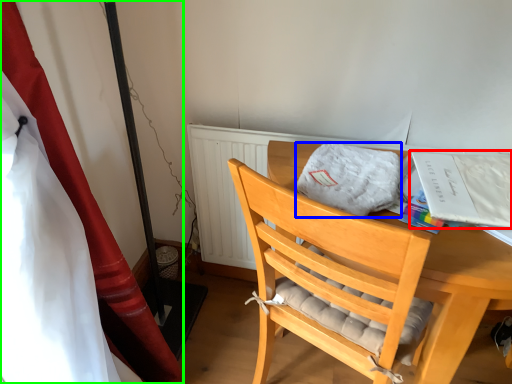
Question: Estimate the real-world distances between objects in this image. Which object is closer to magazine (highlighted by a red box), cloth (highlighted by a blue box) or curtain (highlighted by a green box)?

Choices:
 (A) cloth
 (B) curtain

Answer: (A)